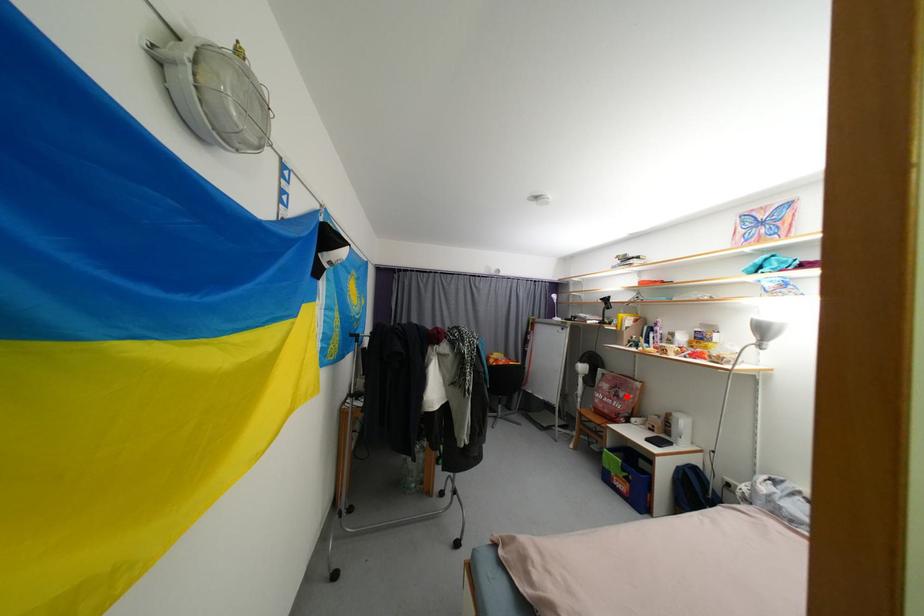
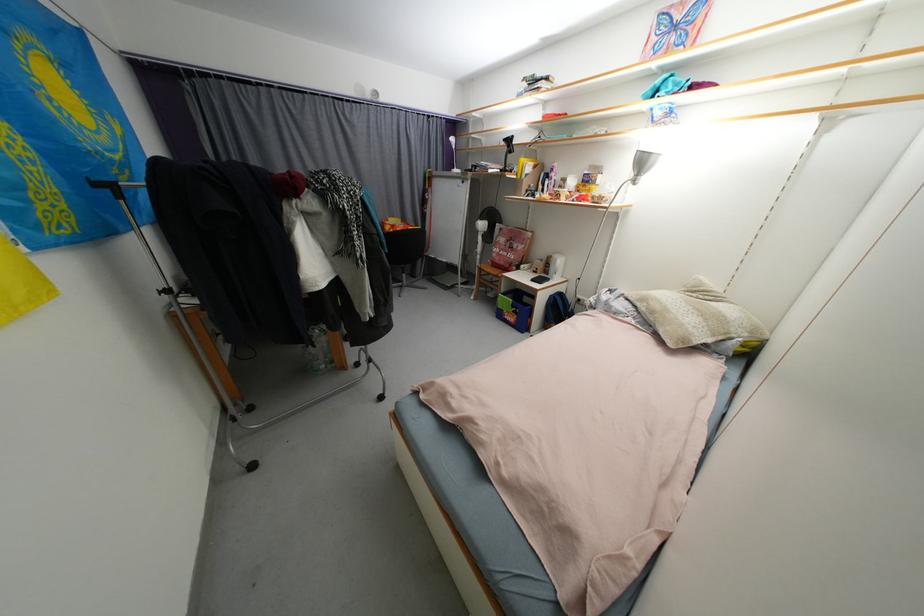
Question: I am providing you with two images of the same scene from different viewpoints. Given a red point in image1, look at the same physical point in image2. Is it:

Choices:
 (A) Closer to the viewpoint
 (B) Farther from the viewpoint

Answer: (A)